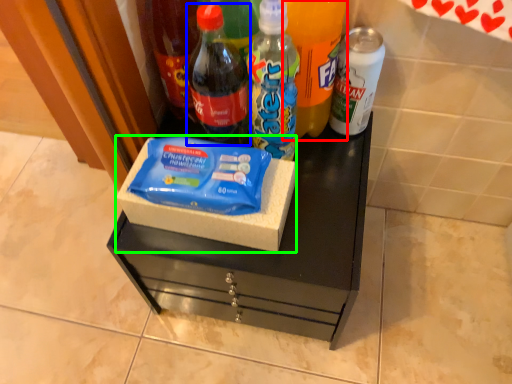
Question: Considering the real-world distances, which object is farthest from bottle (highlighted by a red box)? bottle (highlighted by a blue box) or box (highlighted by a green box)?

Choices:
 (A) bottle
 (B) box

Answer: (B)